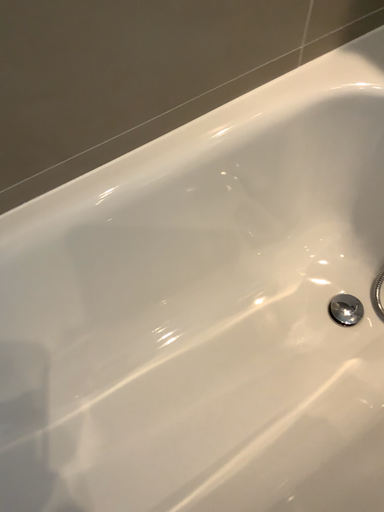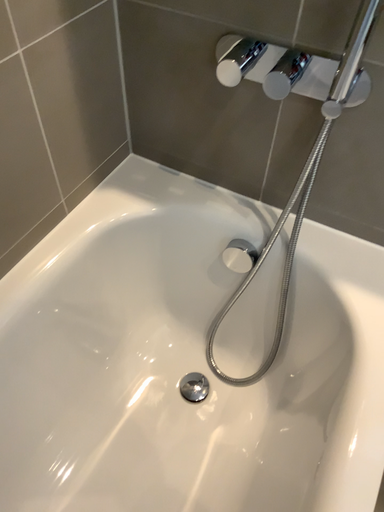
Question: How did the camera likely rotate when shooting the video?

Choices:
 (A) rotated left
 (B) rotated right

Answer: (B)